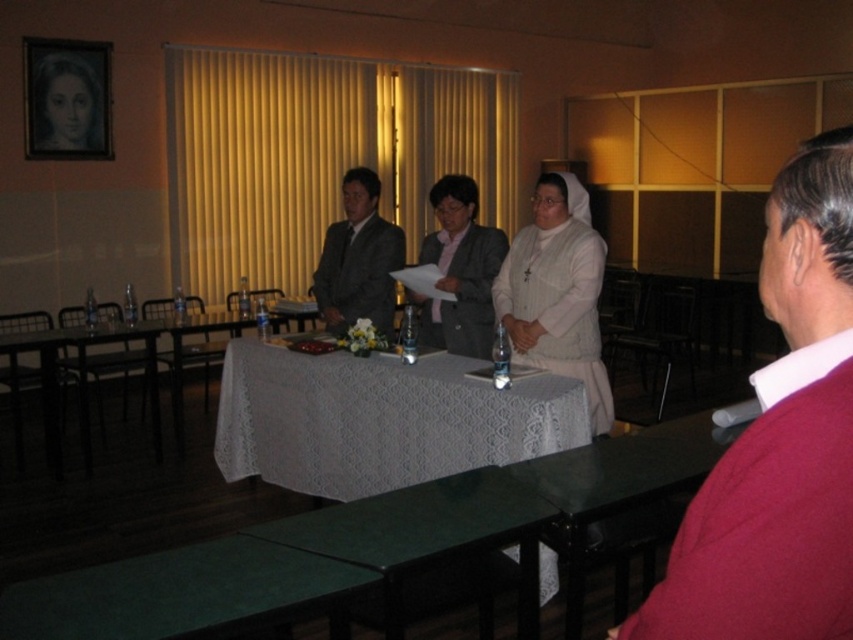
You are a photographer setting up for a formal event. You need to position a camera so that both the white knitted sweater at center and the matte gray suit at center are visible. Which object should you ensure is closer to the camera to avoid blocking the other?

The white knitted sweater at center is in front of the matte gray suit at center, so to avoid blocking the matte gray suit at center, you should position the camera so that the white knitted sweater at center is closer to the camera.

You are planning to place a new decorative item between the wooden portrait at upper left and the dark gray wool business suit at center. Based on their current positions, which side should you place it on to keep it between them?

The wooden portrait at upper left is positioned on the left side of the dark gray wool business suit at center, so placing the decorative item to the right of the wooden portrait at upper left and to the left of the dark gray wool business suit at center would keep it between them.

You are a guest attending an event in this room and need to locate the dark gray wool business suit at center. Where should you look relative to the wooden portrait at upper left?

The dark gray wool business suit at center is below the wooden portrait at upper left, so you should look downward from the wooden portrait at upper left to find it.